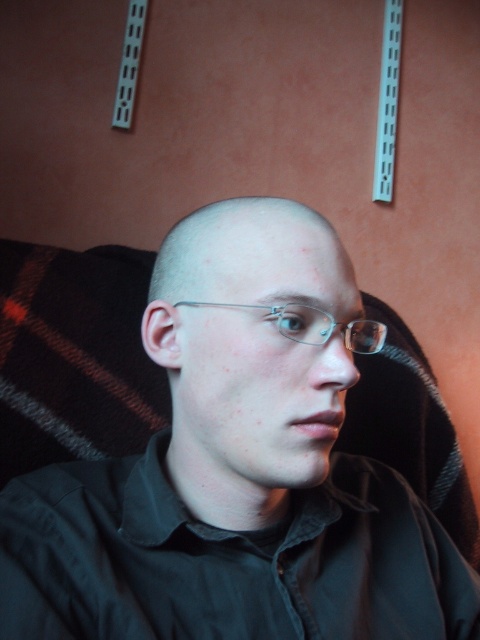
Question: Is matte black shirt at center to the left of clear plastic glasses at center from the viewer's perspective?

Choices:
 (A) no
 (B) yes

Answer: (B)

Question: Which object appears farthest from the camera in this image?

Choices:
 (A) clear plastic glasses at center
 (B) matte black glasses at center

Answer: (B)

Question: Does matte black glasses at center have a smaller size compared to clear plastic glasses at center?

Choices:
 (A) no
 (B) yes

Answer: (A)

Question: Does matte black shirt at center have a smaller size compared to clear plastic glasses at center?

Choices:
 (A) no
 (B) yes

Answer: (A)

Question: Which point appears farthest from the camera in this image?

Choices:
 (A) (235, 371)
 (B) (316, 326)

Answer: (B)

Question: Which of these objects is positioned closest to the matte black glasses at center?

Choices:
 (A) clear plastic glasses at center
 (B) matte black shirt at center

Answer: (B)